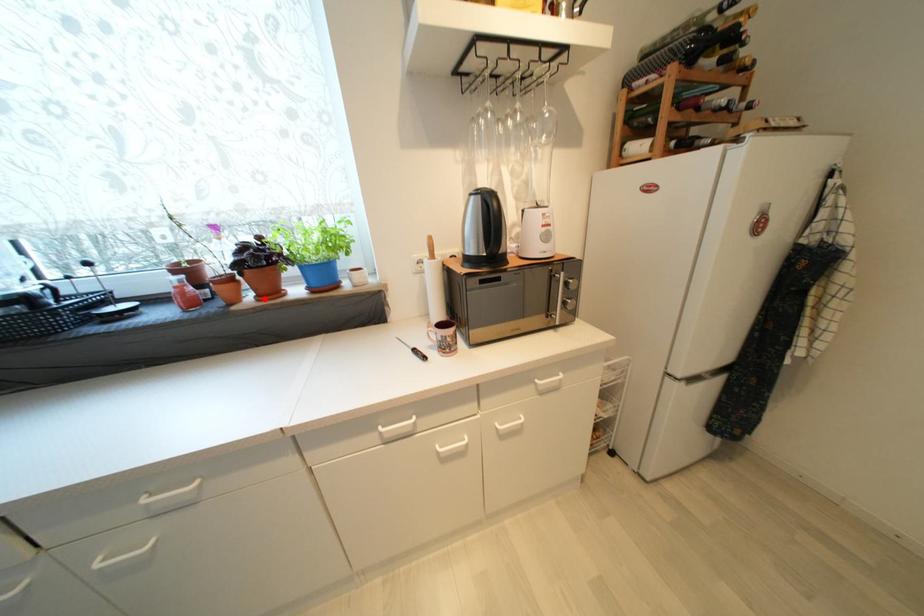
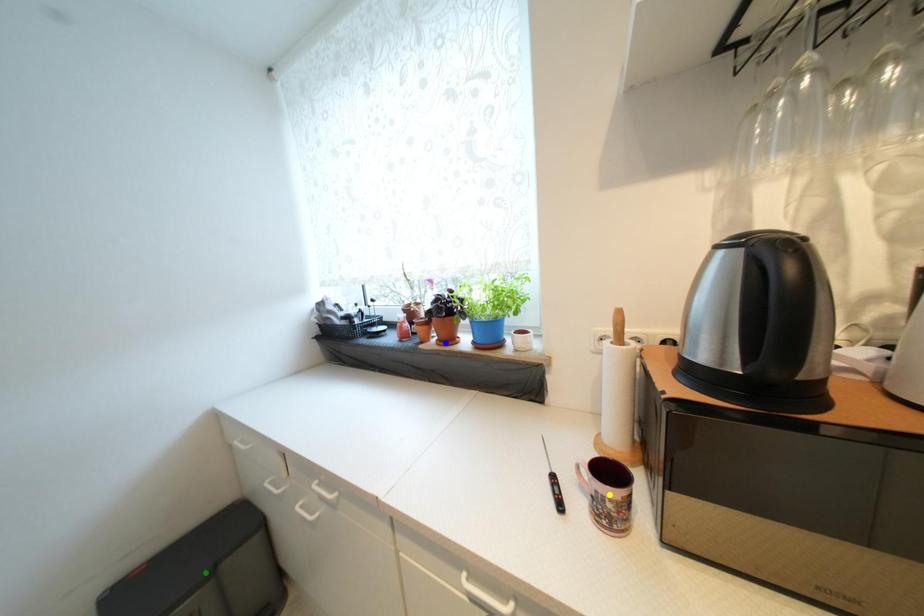
Question: I am providing you with two images of the same scene from different viewpoints. A red point is marked on the first image. You are given multiple points on the second image. Which point in image 2 is actually the same real-world point as the red point in image 1?

Choices:
 (A) green point
 (B) yellow point
 (C) blue point

Answer: (C)